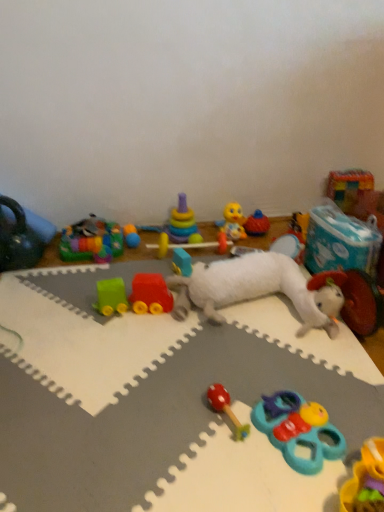
Find the location of a particular element. free space between rubber ball at center, which appears as the 3th toy when viewed from the left, and rubberized plastic toy at center, marked as the sixth toy in a left-to-right arrangement is located at coordinates (160, 248).